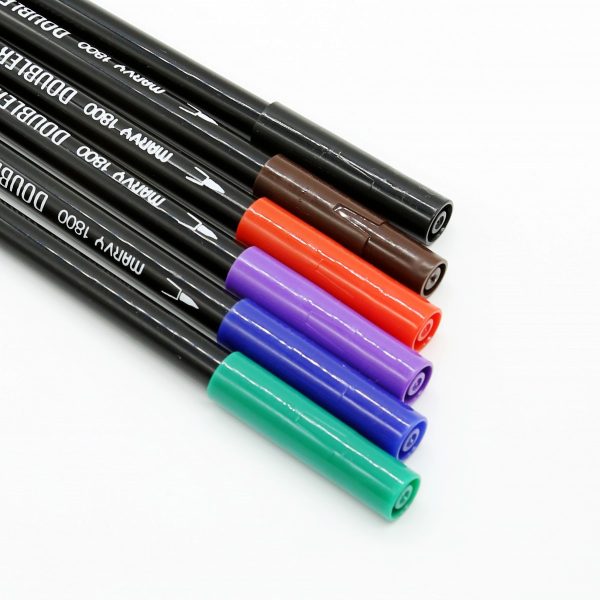
You are a GUI agent. You are given a task and a screenshot of the screen. Output one action in this format:
    pyautogui.click(x=<x>, y=<y>)
    Task: Click on the colored markers
    The image size is (600, 600).
    Given the screenshot: What is the action you would take?
    pyautogui.click(x=104, y=291), pyautogui.click(x=142, y=255), pyautogui.click(x=144, y=208), pyautogui.click(x=164, y=162), pyautogui.click(x=191, y=123), pyautogui.click(x=206, y=87)